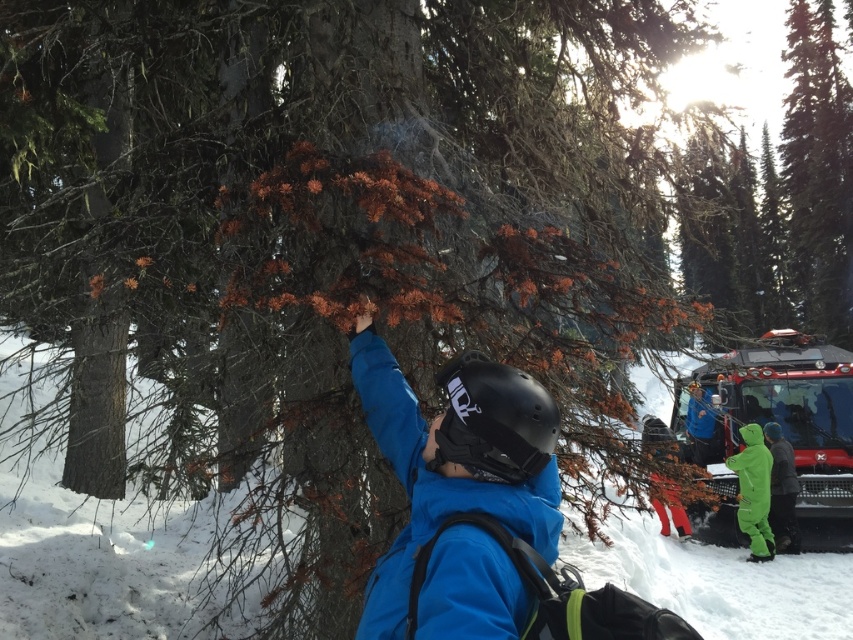
Which is more to the right, green matte snowsuit at lower right or green ski suit at lower right?

green ski suit at lower right is more to the right.

Is green matte snowsuit at lower right below green ski suit at lower right?

Correct, green matte snowsuit at lower right is located below green ski suit at lower right.

Which is in front, point (773, 545) or point (791, 476)?

Point (773, 545) is in front.

I want to click on green matte snowsuit at lower right, so click(753, 492).

Can you confirm if white powdery snow at center is positioned to the left of blue matte jacket at center?

No, white powdery snow at center is not to the left of blue matte jacket at center.

Which is in front, point (84, 560) or point (466, 404)?

Point (466, 404)

Find the location of `white powdery snow at center`. white powdery snow at center is located at coordinates [97, 560].

Where is `red matte fire truck at lower right`? The height and width of the screenshot is (640, 853). red matte fire truck at lower right is located at coordinates (786, 419).

At what (x,y) coordinates should I click in order to perform the action: click on red matte fire truck at lower right. Please return your answer as a coordinate pair (x, y). Looking at the image, I should click on (786, 419).